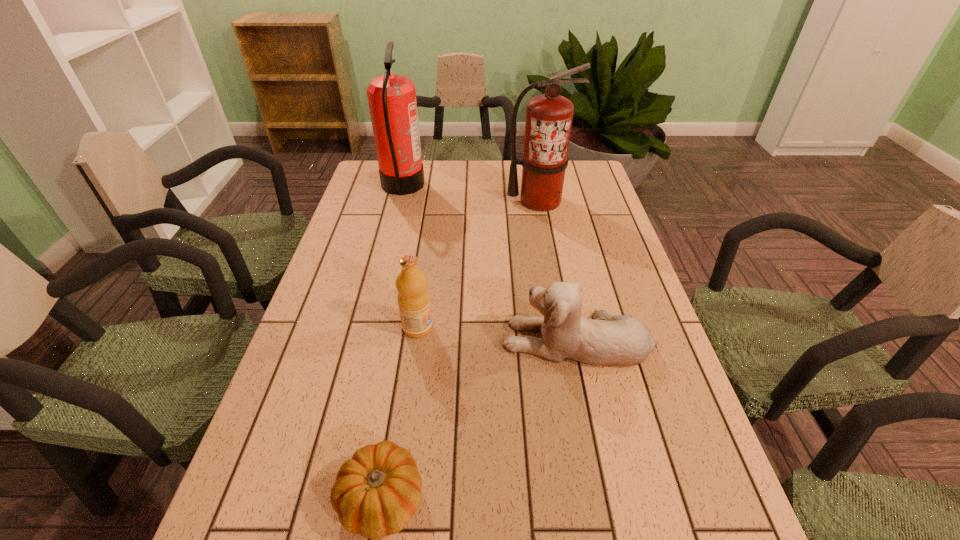
Find the location of a particular element. The height and width of the screenshot is (540, 960). object that is at the left edge is located at coordinates (392, 102).

Image resolution: width=960 pixels, height=540 pixels. What are the coordinates of `fire extinguisher located at the right edge` in the screenshot? It's located at (549, 116).

Find the location of a particular element. This screenshot has width=960, height=540. puppy positioned at the right edge is located at coordinates (x=621, y=340).

I want to click on object present at the far left corner, so click(x=392, y=102).

Locate an element on the screen. The width and height of the screenshot is (960, 540). object located at the far right corner is located at coordinates (549, 116).

Identify the location of vacant region at the far edge of the desktop. This screenshot has width=960, height=540. [448, 166].

You are a GUI agent. You are given a task and a screenshot of the screen. Output one action in this format:
    pyautogui.click(x=<x>, y=<y>)
    Task: Click on the vacant space at the left edge of the desktop
    The height and width of the screenshot is (540, 960).
    Given the screenshot: What is the action you would take?
    pyautogui.click(x=394, y=212)

Locate an element on the screen. vacant space at the right edge of the desktop is located at coordinates (651, 432).

You are a GUI agent. You are given a task and a screenshot of the screen. Output one action in this format:
    pyautogui.click(x=<x>, y=<y>)
    Task: Click on the empty location between the puppy and the fruit juice
    
    Given the screenshot: What is the action you would take?
    pyautogui.click(x=497, y=334)

At what (x,y) coordinates should I click in order to perform the action: click on vacant space that's between the third shortest object and the puppy. Please return your answer as a coordinate pair (x, y). The height and width of the screenshot is (540, 960). Looking at the image, I should click on (497, 334).